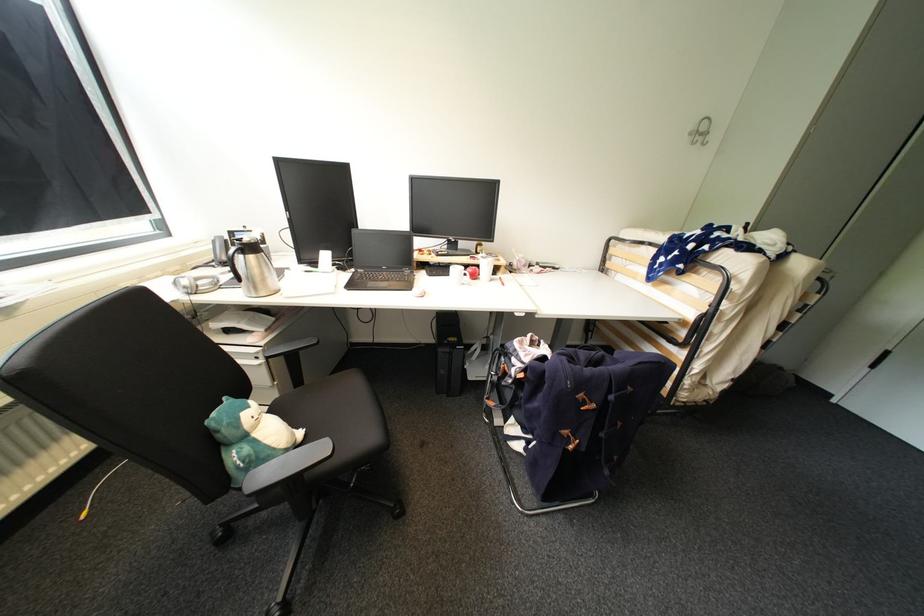
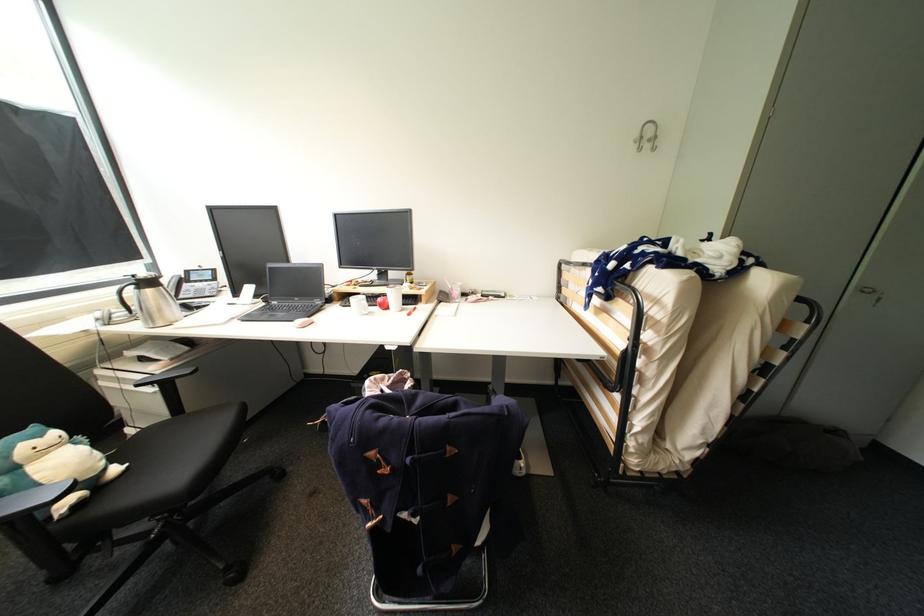
Question: Based on the continuous images, in which direction is the camera rotating? Reply with the corresponding letter.

Choices:
 (A) Left
 (B) Right
 (C) Up
 (D) Down

Answer: (A)